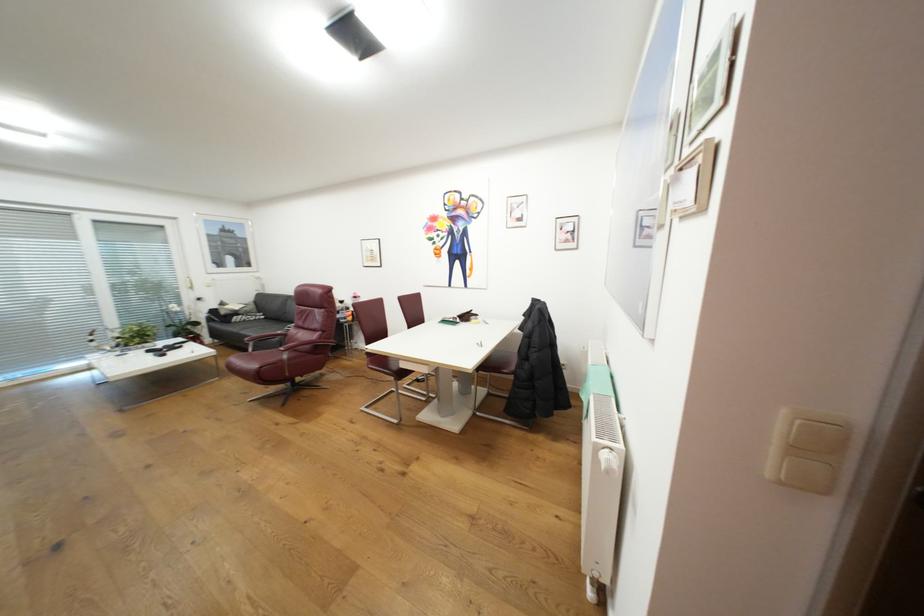
Where would you resting arm the red chair armrest? Please return your answer as a coordinate pair (x, y).

(265, 339)